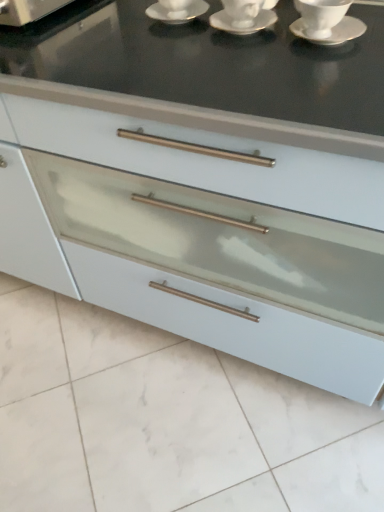
You are a GUI agent. You are given a task and a screenshot of the screen. Output one action in this format:
    pyautogui.click(x=<x>, y=<y>)
    Task: Click on the free space in front of white glossy saucer at upper right, the third saucer from the left
    The width and height of the screenshot is (384, 512).
    Given the screenshot: What is the action you would take?
    pyautogui.click(x=329, y=72)